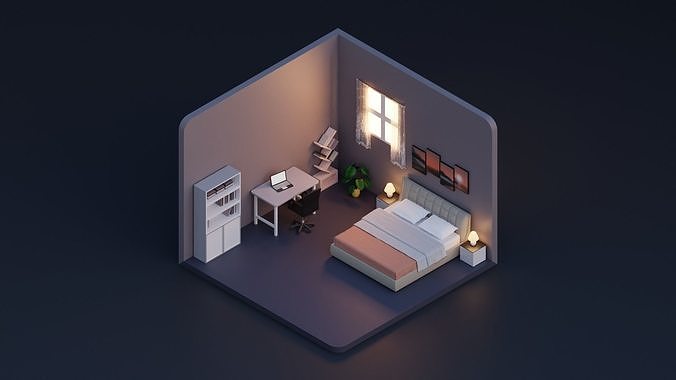
The width and height of the screenshot is (676, 380). Find the location of `shelf`. shelf is located at coordinates (328, 146).